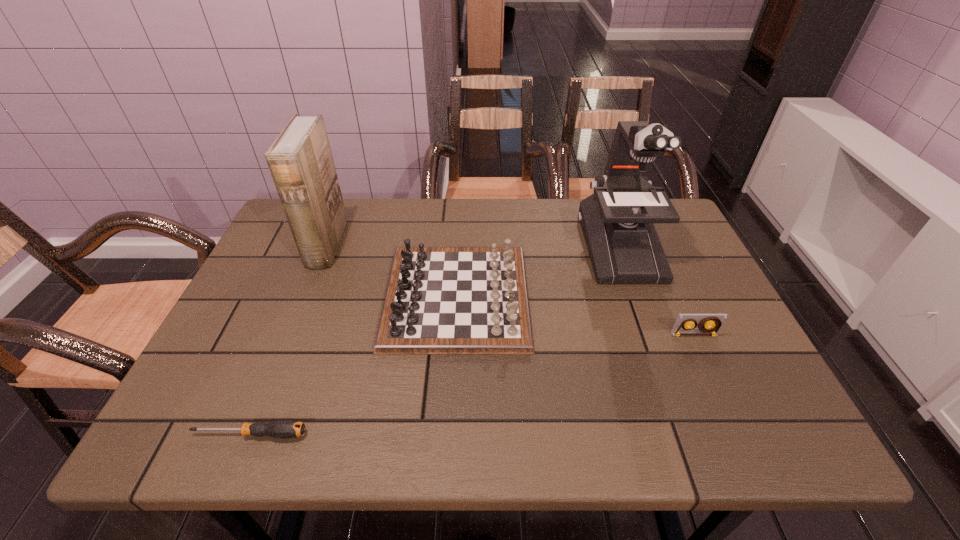
The height and width of the screenshot is (540, 960). Find the location of `object that is the fourth closest to the videotape`. object that is the fourth closest to the videotape is located at coordinates (300, 161).

You are a GUI agent. You are given a task and a screenshot of the screen. Output one action in this format:
    pyautogui.click(x=<x>, y=<y>)
    Task: Click on the object that is the third closest to the microscope
    Image resolution: width=960 pixels, height=540 pixels.
    Given the screenshot: What is the action you would take?
    pyautogui.click(x=300, y=161)

At what (x,y) coordinates should I click in order to perform the action: click on vacant space that satisfies the following two spatial constraints: 1. from the player's perspective of the chessboard; 2. on the front side of the shortest object. Please return your answer as a coordinate pair (x, y). Image resolution: width=960 pixels, height=540 pixels. Looking at the image, I should click on (449, 434).

Image resolution: width=960 pixels, height=540 pixels. I want to click on vacant space that satisfies the following two spatial constraints: 1. through the eyepieces of the microscope; 2. from the player's perspective of the chessboard, so click(637, 297).

Image resolution: width=960 pixels, height=540 pixels. I want to click on vacant area that satisfies the following two spatial constraints: 1. on the cover of the phonebook; 2. on the front side of the shortest object, so click(251, 434).